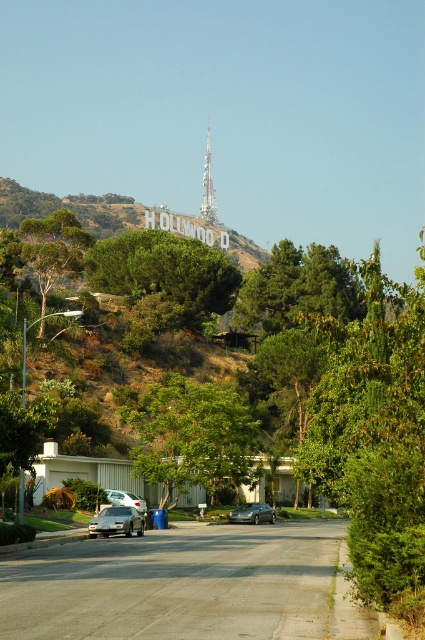
You are a delivery driver trying to park your satin silver sedan at lower left. There is a silver metallic sedan at center blocking the parking spot. Can you park your car without moving the other vehicle?

The satin silver sedan at lower left is positioned over the silver metallic sedan at center, meaning it is already parked in the spot while blocking the other vehicle. Therefore, you cannot park your car there without moving the silver metallic sedan at center.

You are a photographer planning to take a picture of the Hollywood sign. You have a green leafy tree at left and a satin silver sedan at lower center in your viewfinder. Which object should you move to the right to frame the Hollywood sign better?

To frame the Hollywood sign better, you should move the green leafy tree at left to the right since it is currently on the left side of the satin silver sedan at lower center and might be obstructing the view.